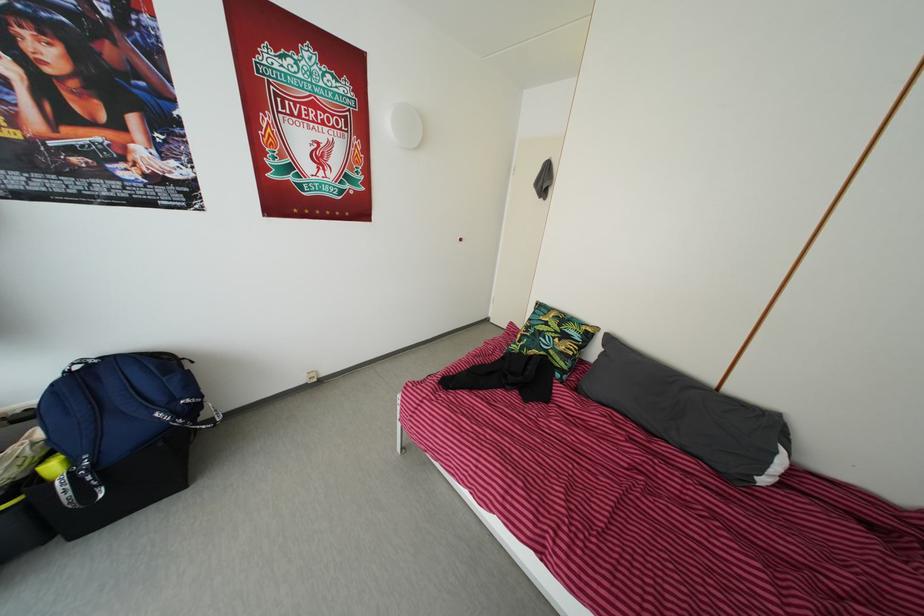
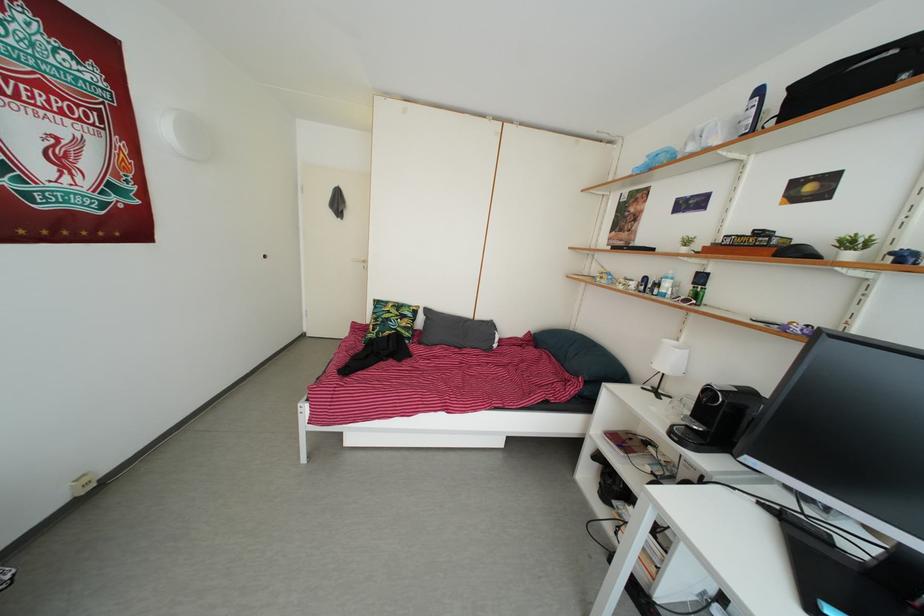
Find the pixel in the second image that matches (x=770, y=488) in the first image.

(502, 354)